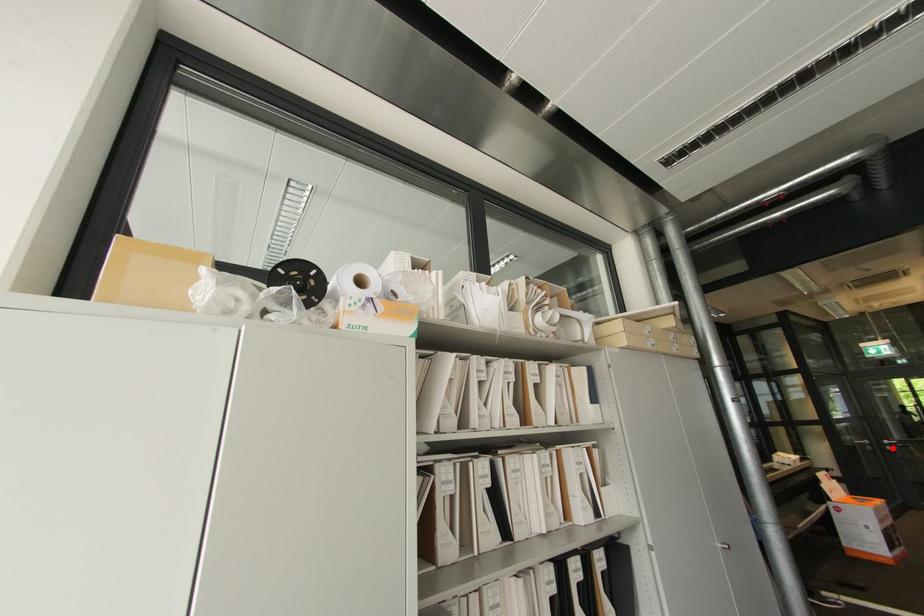
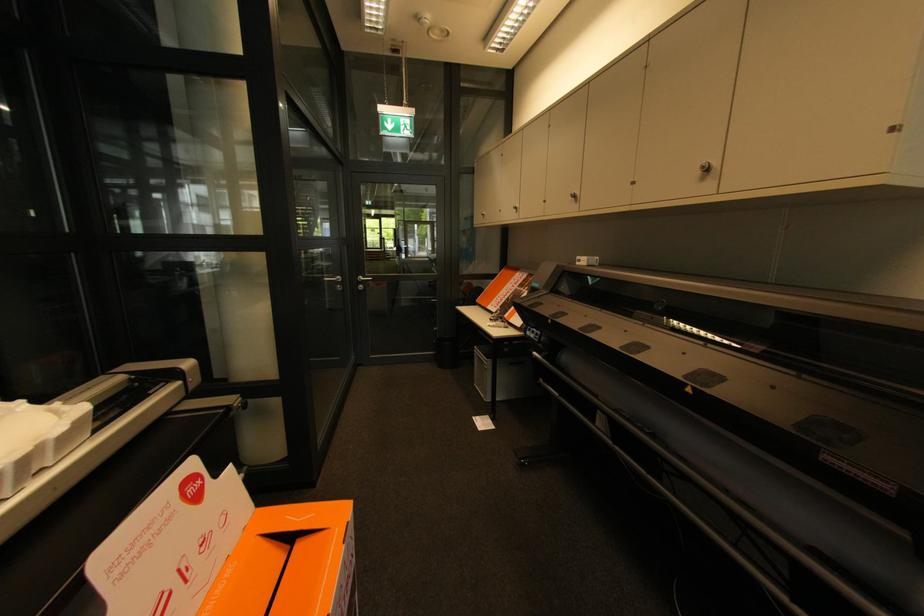
Question: I am providing you with two images of the same scene from different viewpoints. Image1 has a red point marked. In image2, the corresponding 3D location appears at what relative position? Reply with the corresponding letter.

Choices:
 (A) Closer
 (B) Farther

Answer: (A)